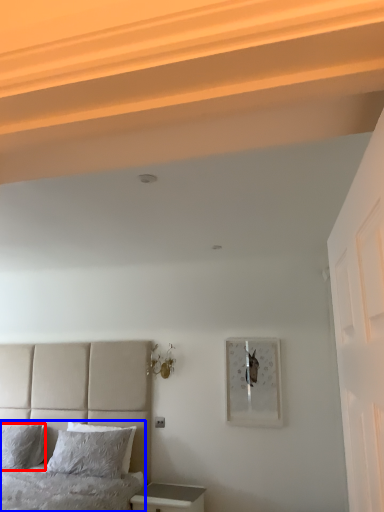
Question: Which point is closer to the camera, pillow (highlighted by a red box) or bed (highlighted by a blue box)?

Choices:
 (A) pillow
 (B) bed

Answer: (B)